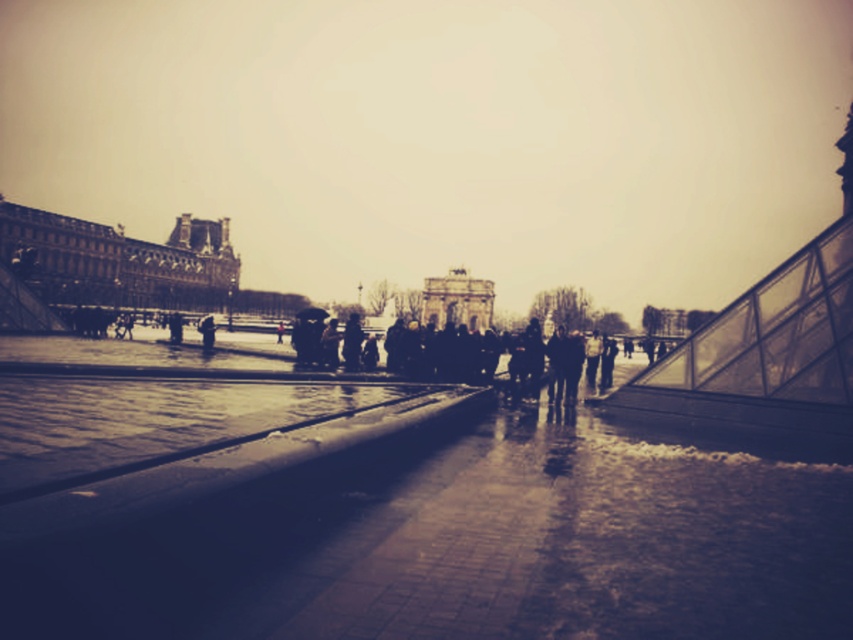
Is point (134, 268) closer to viewer compared to point (387, 337)?

No, it is behind (387, 337).

Can you confirm if dark brown stone palace at left is smaller than dark gray fabric coat at center?

No.

The height and width of the screenshot is (640, 853). Identify the location of dark brown stone palace at left. point(120,260).

Image resolution: width=853 pixels, height=640 pixels. In order to click on dark brown stone palace at left in this screenshot , I will do `click(120, 260)`.

Is dark brown stone palace at left below stone archway at center?

Actually, dark brown stone palace at left is above stone archway at center.

Who is more distant from viewer, (115, 252) or (466, 316)?

The point (466, 316) is behind.

You are a GUI agent. You are given a task and a screenshot of the screen. Output one action in this format:
    pyautogui.click(x=<x>, y=<y>)
    Task: Click on the dark brown stone palace at left
    
    Given the screenshot: What is the action you would take?
    pyautogui.click(x=120, y=260)

Locate an element on the screen. Image resolution: width=853 pixels, height=640 pixels. dark brown stone palace at left is located at coordinates (120, 260).

In the scene shown: How far apart are dark gray fabric coat at center and stone archway at center?

dark gray fabric coat at center is 66.26 meters from stone archway at center.

Which is behind, point (328, 353) or point (480, 282)?

Point (480, 282)

Which is in front, point (486, 348) or point (492, 296)?

Point (486, 348) is more forward.

Identify the location of dark gray fabric coat at center. (526, 362).